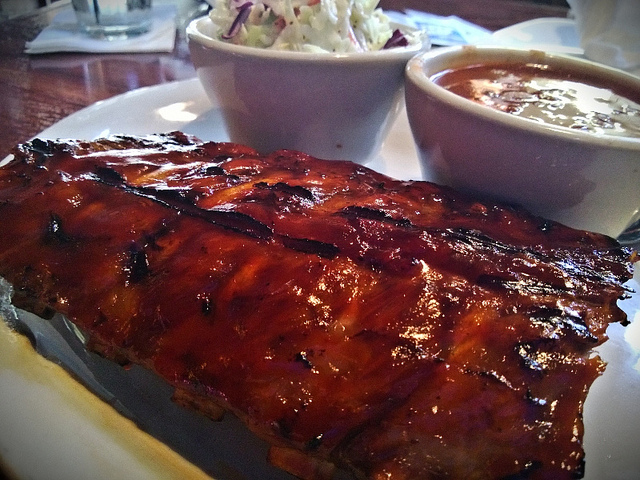
Locate an element on the screen. The width and height of the screenshot is (640, 480). soup inside ramekin is located at coordinates (540, 108).